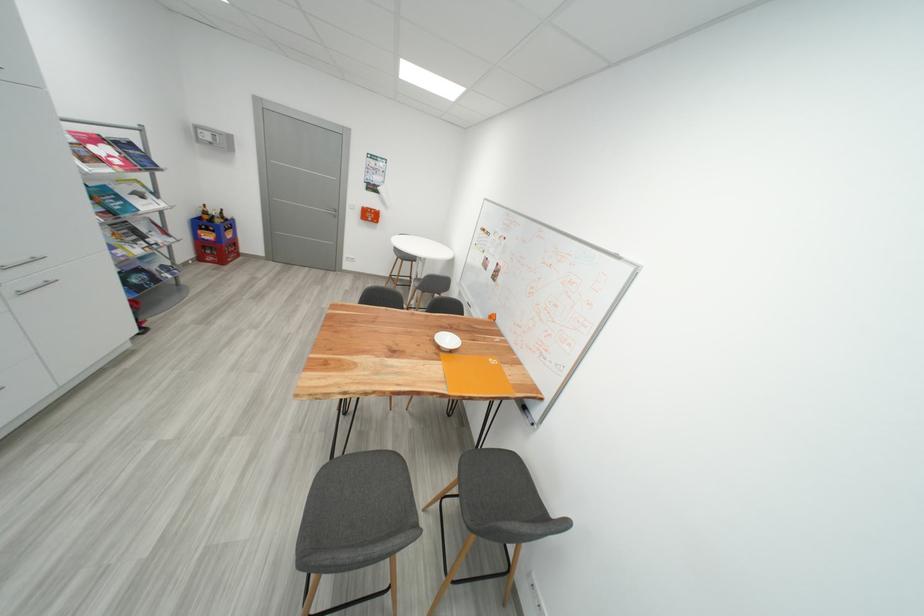
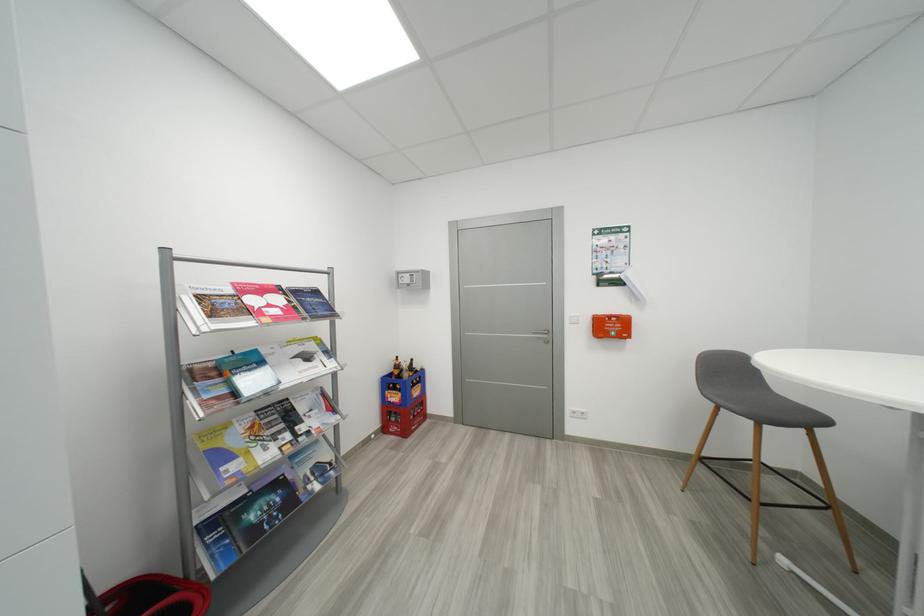
Locate, in the second image, the point that corresponds to [213,215] in the first image.

(404, 369)